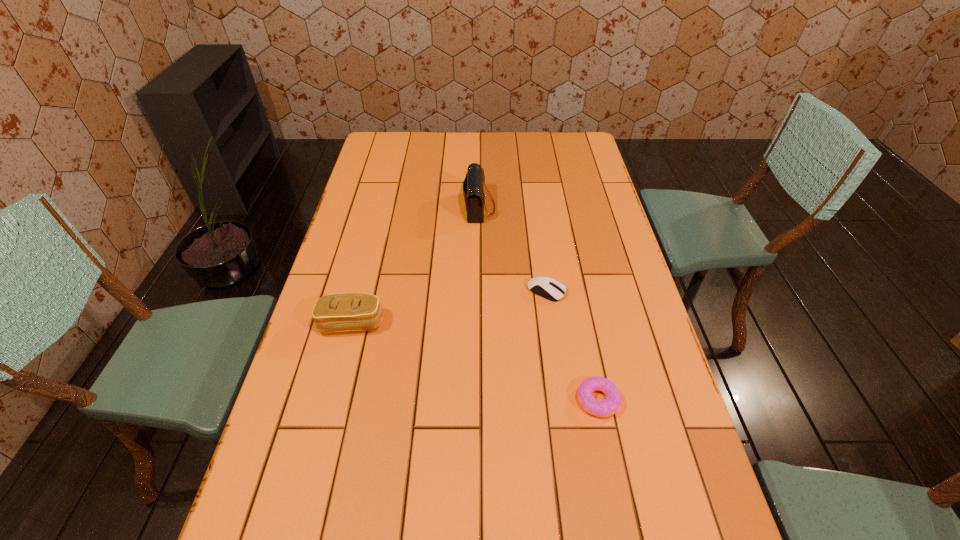
Identify the location of free space between the mouse and the nearest object. [x=572, y=346].

You are a GUI agent. You are given a task and a screenshot of the screen. Output one action in this format:
    pyautogui.click(x=<x>, y=<y>)
    Task: Click on the empty space that is in between the second object from left to right and the nearest object
    The height and width of the screenshot is (540, 960).
    Given the screenshot: What is the action you would take?
    [539, 303]

At what (x,y) coordinates should I click in order to perform the action: click on empty space that is in between the doughnut and the mouse. Please return your answer as a coordinate pair (x, y). This screenshot has width=960, height=540. Looking at the image, I should click on (572, 346).

Locate an element on the screen. Image resolution: width=960 pixels, height=540 pixels. vacant region between the right clutch bag and the leftmost object is located at coordinates (416, 265).

Locate an element on the screen. free area in between the third nearest object and the nearest object is located at coordinates (572, 346).

Where is `empty space between the second farthest object and the leftmost object`? The image size is (960, 540). empty space between the second farthest object and the leftmost object is located at coordinates (449, 307).

Locate an element on the screen. unoccupied position between the mouse and the leftmost object is located at coordinates (449, 307).

Identify the location of the closest object to the right clutch bag. (549, 288).

Select which object is the third closest to the nearer clutch bag. Please provide its 2D coordinates. Your answer should be formatted as a tuple, i.e. [(x, y)], where the tuple contains the x and y coordinates of a point satisfying the conditions above.

[(605, 408)]

You are a GUI agent. You are given a task and a screenshot of the screen. Output one action in this format:
    pyautogui.click(x=<x>, y=<y>)
    Task: Click on the vacant space that satisfies the following two spatial constraints: 1. on the zipper side of the leftmost object; 2. on the left side of the nearest object
    The height and width of the screenshot is (540, 960).
    Given the screenshot: What is the action you would take?
    pyautogui.click(x=332, y=400)